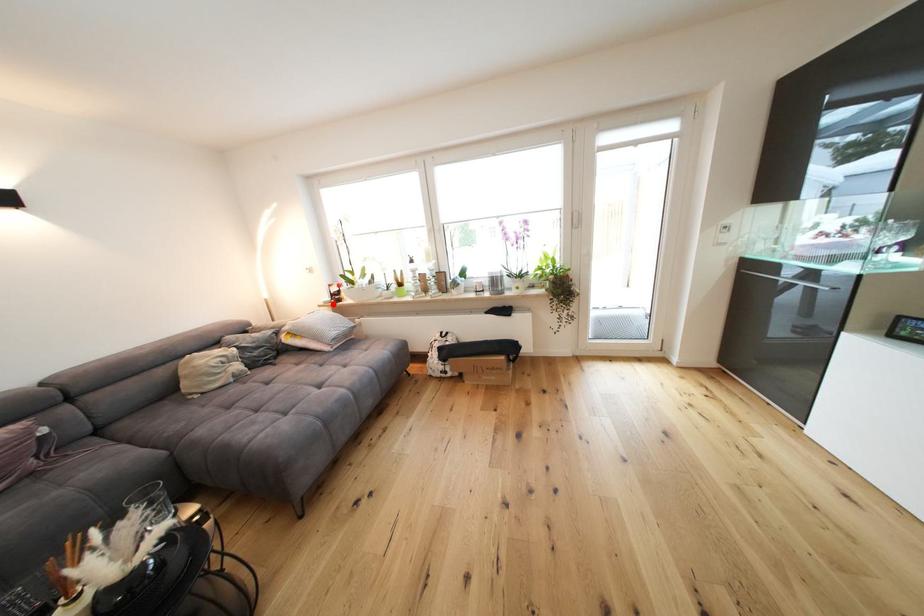
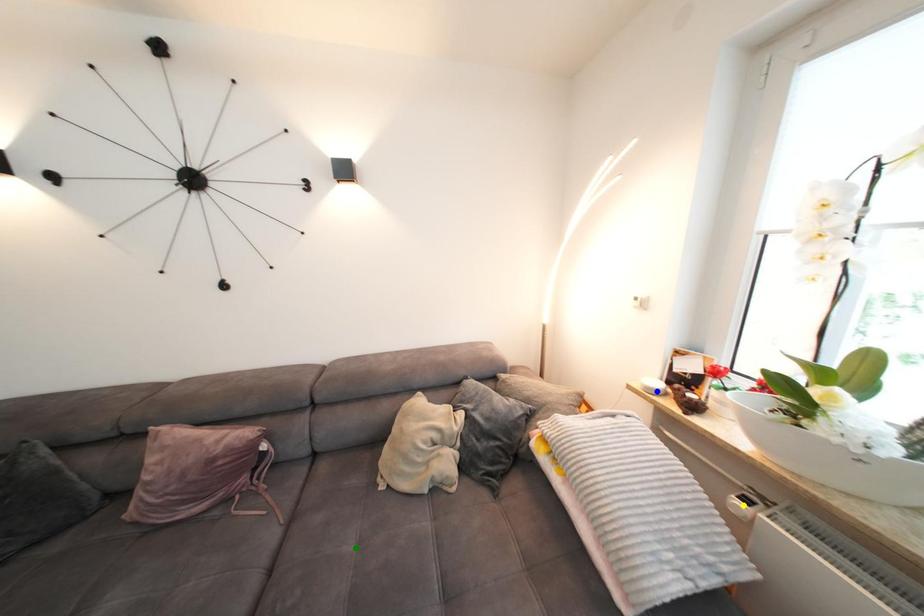
Question: I am providing you with two images of the same scene from different viewpoints. A red point is marked on the first image. You are given multiple points on the second image. Which point in image 2 is actually the same real-world point as the red point in image 1?

Choices:
 (A) blue point
 (B) green point
 (C) yellow point

Answer: (A)